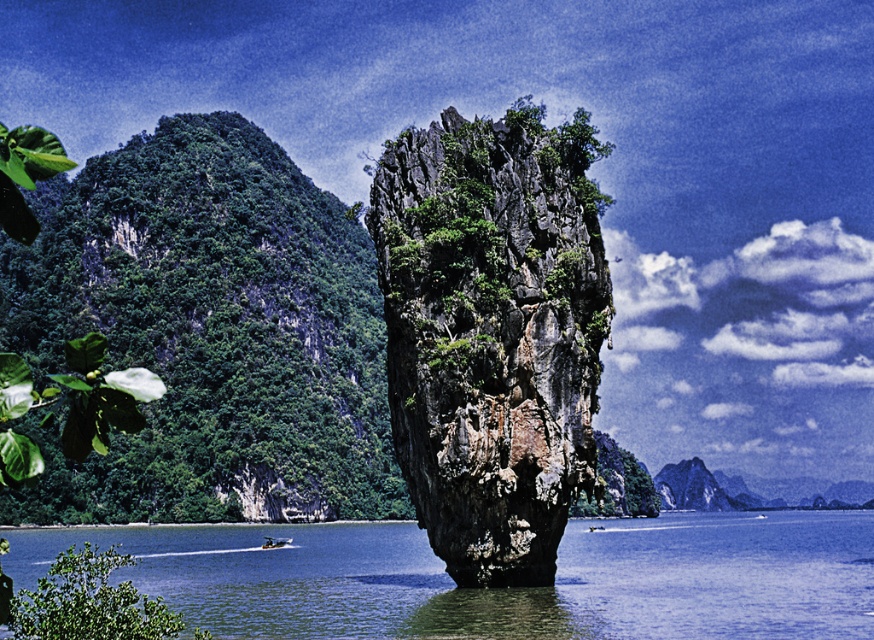
You are standing at the base of the large rock formation in the image and notice a point marked at coordinates (87,602). What is located at this point?

The point marked at coordinates (87,602) indicates the location of a green leafy bush at lower left.